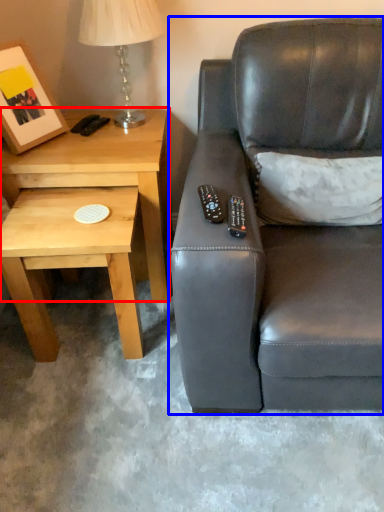
Question: Which object is further to the camera taking this photo, table (highlighted by a red box) or studio couch (highlighted by a blue box)?

Choices:
 (A) table
 (B) studio couch

Answer: (A)